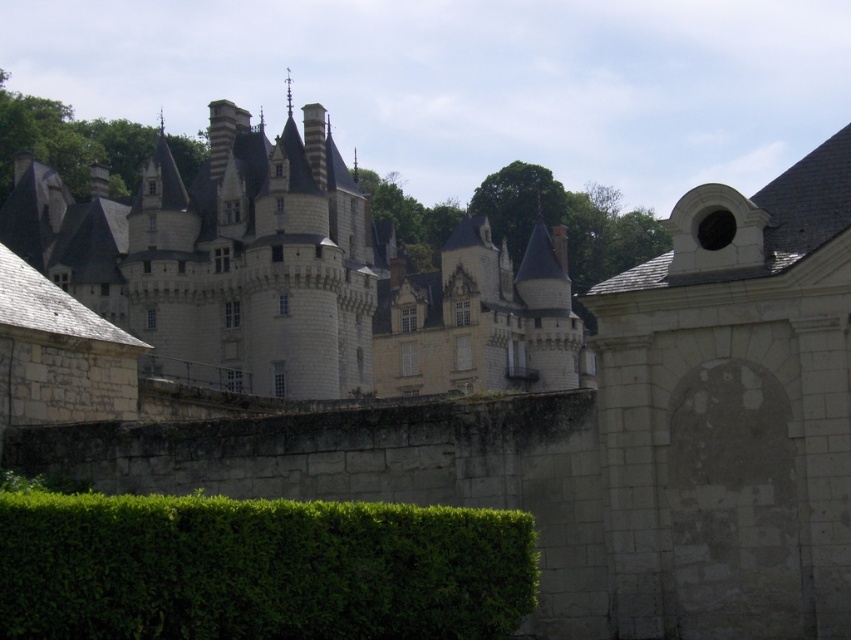
Question: Does white stone castle at center appear over green leafy hedge at lower left?

Choices:
 (A) yes
 (B) no

Answer: (A)

Question: Does white stone castle at center have a greater width compared to green leafy hedge at lower left?

Choices:
 (A) yes
 (B) no

Answer: (A)

Question: Is white stone castle at center below green leafy hedge at lower left?

Choices:
 (A) yes
 (B) no

Answer: (B)

Question: Among these points, which one is nearest to the camera?

Choices:
 (A) (355, 593)
 (B) (216, 253)

Answer: (A)